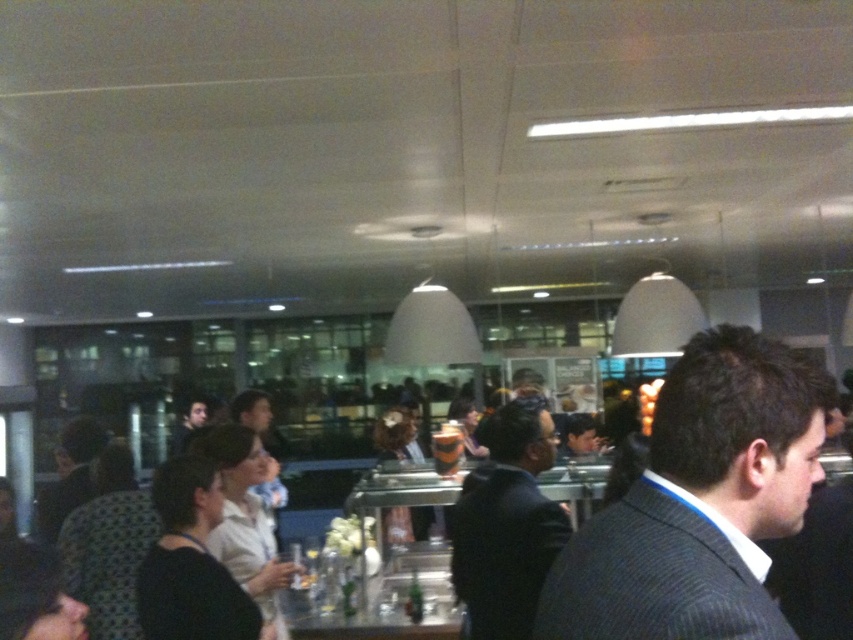
You are a photographer standing at the entrance of the cafe. You want to take a photo of the dark gray suit at center. Where should you position yourself to ensure the point at coordinates point [700,500] is clearly visible in the frame?

The point at coordinates point [700,500] is located on the dark gray suit at center, so positioning yourself centrally in the cafe would ensure the point is clearly visible in the frame.

You are a photographer standing at the entrance of the cafe and want to take a photo of the gray pinstripe suit at center and the clear glass table at center. Which object will appear larger in your photo?

The gray pinstripe suit at center will appear larger in the photo because it is closer to the viewer than the clear glass table at center.

You are a photographer at the event and want to capture both the dark gray suit at center and the gray pinstripe suit at center in a single photo. Which suit should you focus on first to ensure both are in frame?

The dark gray suit at center is positioned over the gray pinstripe suit at center, so focusing on the dark gray suit at center first will ensure both are visible in the photo.